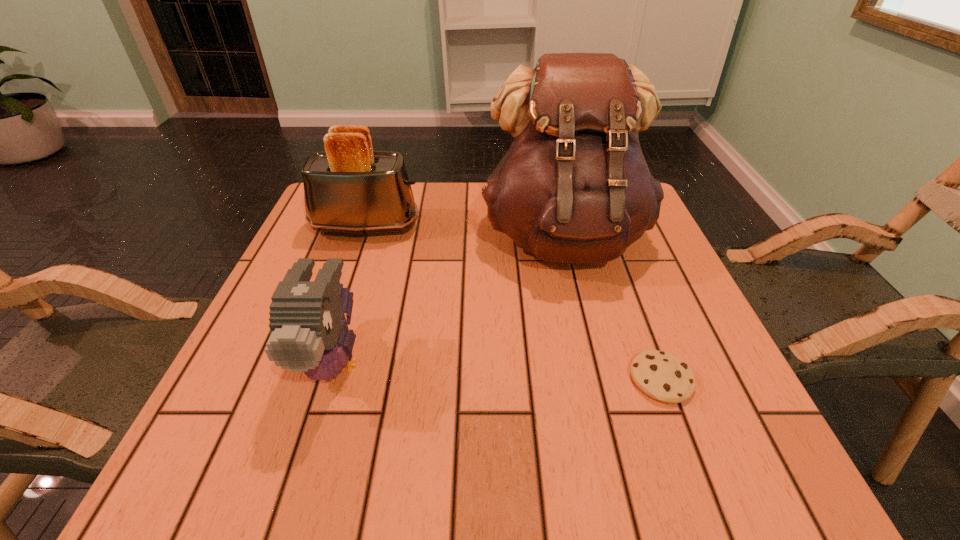
Identify the location of vacant space that is in between the tallest object and the bird. This screenshot has width=960, height=540. (449, 299).

Find the location of a particular element. empty space between the cookie and the second shortest object is located at coordinates click(498, 370).

This screenshot has width=960, height=540. I want to click on unoccupied area between the tallest object and the second tallest object, so pyautogui.click(x=465, y=232).

At what (x,y) coordinates should I click in order to perform the action: click on vacant space that's between the second shortest object and the shortest object. Please return your answer as a coordinate pair (x, y). Looking at the image, I should click on (498, 370).

Locate an element on the screen. free point between the cookie and the bird is located at coordinates (498, 370).

This screenshot has width=960, height=540. I want to click on empty location between the satchel and the toaster, so click(x=465, y=232).

Locate an element on the screen. This screenshot has width=960, height=540. vacant area that lies between the satchel and the cookie is located at coordinates (612, 308).

The image size is (960, 540). Identify the location of vacant region between the satchel and the third tallest object. (449, 299).

Locate which object ranks third in proximity to the bird. Please provide its 2D coordinates. Your answer should be formatted as a tuple, i.e. [(x, y)], where the tuple contains the x and y coordinates of a point satisfying the conditions above.

[(663, 376)]

Point out which object is positioned as the nearest to the shortest object. Please provide its 2D coordinates. Your answer should be formatted as a tuple, i.e. [(x, y)], where the tuple contains the x and y coordinates of a point satisfying the conditions above.

[(574, 187)]